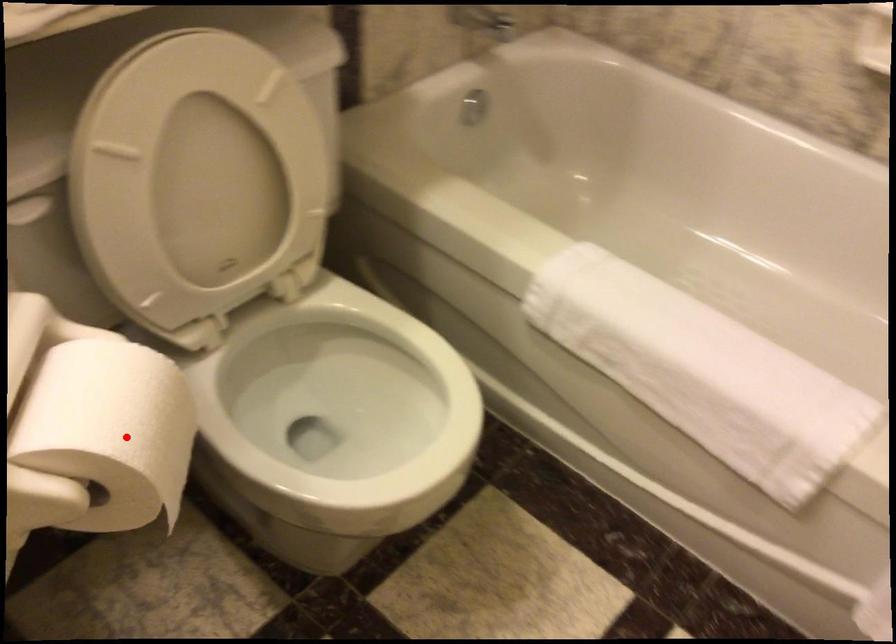
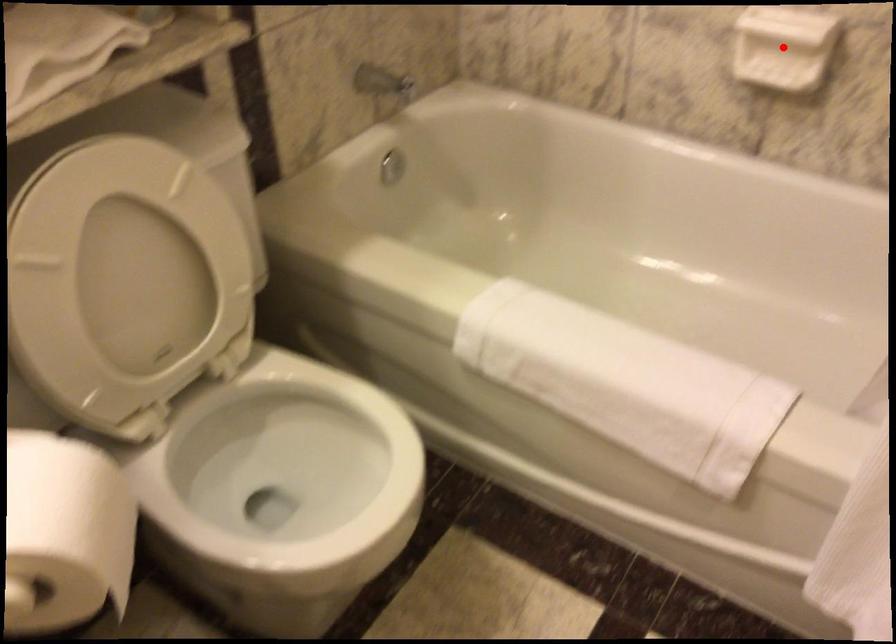
I am providing you with two images of the same scene from different viewpoints. A red point is marked on the first image and another point is marked on the second image. Are the points marked in image1 and image2 representing the same 3D position?

No